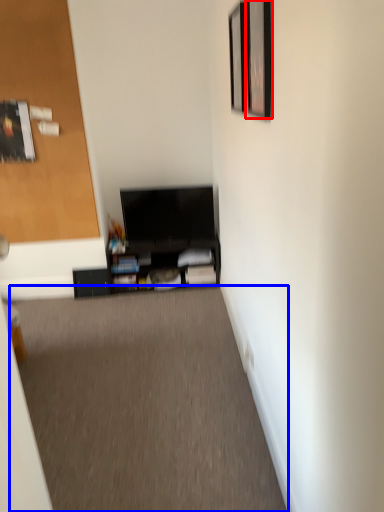
Question: Which object is further to the camera taking this photo, picture frame (highlighted by a red box) or plain (highlighted by a blue box)?

Choices:
 (A) picture frame
 (B) plain

Answer: (B)